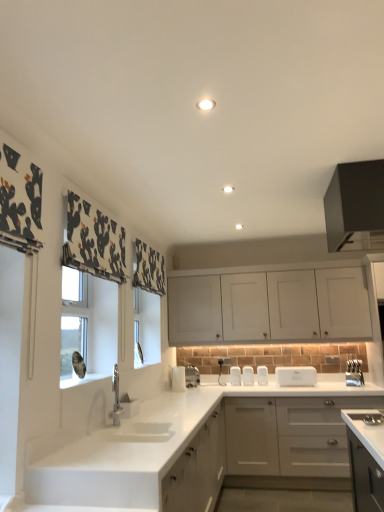
The height and width of the screenshot is (512, 384). In order to click on white plastic toaster at center, acting as the 5th appliance starting from the right in this screenshot , I will do `click(235, 376)`.

The image size is (384, 512). What do you see at coordinates (296, 376) in the screenshot?
I see `white plastic toaster at center, which appears as the 2th appliance when viewed from the right` at bounding box center [296, 376].

How much space does white glossy toaster at lower center, the seventh appliance positioned from the right, occupy horizontally?

The width of white glossy toaster at lower center, the seventh appliance positioned from the right, is 8.81 inches.

The height and width of the screenshot is (512, 384). What are the coordinates of `silver metallic knife block at right, which is counted as the first appliance, starting from the right` in the screenshot? It's located at (354, 373).

This screenshot has height=512, width=384. Describe the element at coordinates (262, 375) in the screenshot. I see `white plastic toaster at center, which is the 3th appliance from right to left` at that location.

How much space does white matte cabinet at upper center, which is counted as the 2th cabinetry, starting from the bottom, occupy horizontally?

It is 16.98 inches.

What are the coordinates of `black matte cabinet at upper right, positioned as the 1th cabinetry in top-to-bottom order` in the screenshot? It's located at (355, 207).

Which object is wider, black matte cabinet at upper right, positioned as the 1th cabinetry in top-to-bottom order, or white plastic toaster at center, which appears as the 2th appliance when viewed from the right?

With larger width is black matte cabinet at upper right, positioned as the 1th cabinetry in top-to-bottom order.

From a real-world perspective, which object stands above the other?

black matte cabinet at upper right, positioned as the 1th cabinetry in top-to-bottom order.

Is black matte cabinet at upper right, the third cabinetry when ordered from bottom to top, bigger or smaller than white plastic toaster at center, which appears as the 2th appliance when viewed from the right?

In the image, black matte cabinet at upper right, the third cabinetry when ordered from bottom to top, appears to be larger than white plastic toaster at center, which appears as the 2th appliance when viewed from the right.

Could you tell me if black matte cabinet at upper right, the third cabinetry when ordered from bottom to top, is turned towards white plastic toaster at center, which appears as the 2th appliance when viewed from the right?

No, black matte cabinet at upper right, the third cabinetry when ordered from bottom to top, does not turn towards white plastic toaster at center, which appears as the 2th appliance when viewed from the right.

Could you measure the distance between white matte cabinet at upper center, marked as the second cabinetry in a top-to-bottom arrangement, and satin nickel faucet at center, the sixth appliance in the right-to-left sequence?

3.42 feet.

From a real-world perspective, starting from the white matte cabinet at upper center, marked as the second cabinetry in a top-to-bottom arrangement, which appliance is the 3rd one below it? Please provide its 2D coordinates.

[(192, 376)]

How many degrees apart are the facing directions of white matte cabinet at upper center, marked as the second cabinetry in a top-to-bottom arrangement, and satin nickel faucet at center, the second appliance viewed from the left?

45 degrees separate the facing orientations of white matte cabinet at upper center, marked as the second cabinetry in a top-to-bottom arrangement, and satin nickel faucet at center, the second appliance viewed from the left.

From the image's perspective, which is above, white matte cabinet at upper center, which is counted as the 2th cabinetry, starting from the bottom, or satin nickel faucet at center, the second appliance viewed from the left?

white matte cabinet at upper center, which is counted as the 2th cabinetry, starting from the bottom, appears higher in the image.

Which object is closer to the camera, white plastic toaster at center, placed as the 5th appliance when sorted from left to right, or satin nickel faucet at center, the sixth appliance in the right-to-left sequence?

satin nickel faucet at center, the sixth appliance in the right-to-left sequence.

Considering the relative sizes of white plastic toaster at center, placed as the 5th appliance when sorted from left to right, and satin nickel faucet at center, the second appliance viewed from the left, in the image provided, is white plastic toaster at center, placed as the 5th appliance when sorted from left to right, bigger than satin nickel faucet at center, the second appliance viewed from the left,?

Actually, white plastic toaster at center, placed as the 5th appliance when sorted from left to right, might be smaller than satin nickel faucet at center, the second appliance viewed from the left.

Is white plastic toaster at center, which is the 3th appliance from right to left, positioned far away from satin nickel faucet at center, the second appliance viewed from the left?

white plastic toaster at center, which is the 3th appliance from right to left, is near satin nickel faucet at center, the second appliance viewed from the left, not far away.

Would you say black matte cabinet at upper right, the third cabinetry when ordered from bottom to top, is part of white plastic toaster at center, the fourth appliance when ordered from right to left,'s contents?

That's incorrect, black matte cabinet at upper right, the third cabinetry when ordered from bottom to top, is not inside white plastic toaster at center, the fourth appliance when ordered from right to left.

From a real-world perspective, which is physically below, white plastic toaster at center, positioned as the fourth appliance in left-to-right order, or black matte cabinet at upper right, the third cabinetry when ordered from bottom to top?

white plastic toaster at center, positioned as the fourth appliance in left-to-right order, from a real-world perspective.

Considering the sizes of white plastic toaster at center, positioned as the fourth appliance in left-to-right order, and black matte cabinet at upper right, the third cabinetry when ordered from bottom to top, in the image, is white plastic toaster at center, positioned as the fourth appliance in left-to-right order, wider or thinner than black matte cabinet at upper right, the third cabinetry when ordered from bottom to top,?

In the image, white plastic toaster at center, positioned as the fourth appliance in left-to-right order, appears to be more narrow than black matte cabinet at upper right, the third cabinetry when ordered from bottom to top.

How far apart are white plastic toaster at center, the fourth appliance when ordered from right to left, and black matte cabinet at upper right, the third cabinetry when ordered from bottom to top?

They are 7.36 feet apart.

Is the position of satin nickel faucet at center, the second appliance viewed from the left, more distant than that of white glossy toaster at lower center, the 1th appliance in the left-to-right sequence?

That is True.

Is white glossy toaster at lower center, the seventh appliance positioned from the right, inside satin nickel faucet at center, the sixth appliance in the right-to-left sequence?

No, white glossy toaster at lower center, the seventh appliance positioned from the right, is not inside satin nickel faucet at center, the sixth appliance in the right-to-left sequence.

Which is more to the right, satin nickel faucet at center, the sixth appliance in the right-to-left sequence, or white glossy toaster at lower center, the 1th appliance in the left-to-right sequence?

Positioned to the right is satin nickel faucet at center, the sixth appliance in the right-to-left sequence.

From their relative heights in the image, would you say satin nickel faucet at center, the second appliance viewed from the left, is taller or shorter than white glossy toaster at lower center, the 1th appliance in the left-to-right sequence?

Clearly, satin nickel faucet at center, the second appliance viewed from the left, is shorter compared to white glossy toaster at lower center, the 1th appliance in the left-to-right sequence.

Which of these two, white matte cabinet at lower left, the 3th cabinetry when ordered from top to bottom, or white plastic toaster at center, the fourth appliance when ordered from right to left, is wider?

white matte cabinet at lower left, the 3th cabinetry when ordered from top to bottom, is wider.

Is white matte cabinet at lower left, the 1th cabinetry positioned from the bottom, closer to the viewer compared to white plastic toaster at center, the fourth appliance when ordered from right to left?

Yes, white matte cabinet at lower left, the 1th cabinetry positioned from the bottom, is in front of white plastic toaster at center, the fourth appliance when ordered from right to left.

Is white matte cabinet at lower left, the 3th cabinetry when ordered from top to bottom, inside the boundaries of white plastic toaster at center, the fourth appliance when ordered from right to left, or outside?

white matte cabinet at lower left, the 3th cabinetry when ordered from top to bottom, is not enclosed by white plastic toaster at center, the fourth appliance when ordered from right to left.

Is point (286, 372) closer or farther from the camera than point (257, 281)?

Point (286, 372) is closer to the camera than point (257, 281).

There is a white matte cabinet at upper center, marked as the second cabinetry in a top-to-bottom arrangement. Identify the location of the 3rd appliance below it (from the image's perspective). (296, 376).

From the image's perspective, is white plastic toaster at center, marked as the sixth appliance in a left-to-right arrangement, located above or below white matte cabinet at upper center, which is counted as the 2th cabinetry, starting from the bottom?

white plastic toaster at center, marked as the sixth appliance in a left-to-right arrangement, is below white matte cabinet at upper center, which is counted as the 2th cabinetry, starting from the bottom.

Consider the image. Would you say white matte cabinet at upper center, which is counted as the 2th cabinetry, starting from the bottom, is part of white plastic toaster at center, which appears as the 2th appliance when viewed from the right,'s contents?

No, white matte cabinet at upper center, which is counted as the 2th cabinetry, starting from the bottom, is not inside white plastic toaster at center, which appears as the 2th appliance when viewed from the right.

Find the location of a particular element. appliance that is the 3rd one when counting backward from the black matte cabinet at upper right, the third cabinetry when ordered from bottom to top is located at coordinates (296, 376).

The height and width of the screenshot is (512, 384). I want to click on cabinetry that is the 1st one when counting upward from the satin nickel faucet at center, the second appliance viewed from the left (from the image's perspective), so click(269, 306).

Considering their positions, is silver metallic knife block at right, which is counted as the first appliance, starting from the right, positioned further to white plastic toaster at center, which appears as the 2th appliance when viewed from the right, than white plastic toaster at center, placed as the 5th appliance when sorted from left to right?

silver metallic knife block at right, which is counted as the first appliance, starting from the right, is further to white plastic toaster at center, which appears as the 2th appliance when viewed from the right.

Estimate the real-world distances between objects in this image. Which object is further from white plastic toaster at center, which appears as the 2th appliance when viewed from the right, white plastic toaster at center, the fourth appliance when ordered from right to left, or white plastic toaster at center, acting as the 5th appliance starting from the right?

white plastic toaster at center, acting as the 5th appliance starting from the right.

Estimate the real-world distances between objects in this image. Which object is further from white matte cabinet at lower left, the 1th cabinetry positioned from the bottom, white matte cabinet at upper center, marked as the second cabinetry in a top-to-bottom arrangement, or white plastic toaster at center, which appears as the 2th appliance when viewed from the right?

Among the two, white matte cabinet at upper center, marked as the second cabinetry in a top-to-bottom arrangement, is located further to white matte cabinet at lower left, the 1th cabinetry positioned from the bottom.

From the image, which object appears to be farther from satin nickel faucet at center, the second appliance viewed from the left, white matte cabinet at lower left, the 3th cabinetry when ordered from top to bottom, or white plastic toaster at center, acting as the 5th appliance starting from the right?

white matte cabinet at lower left, the 3th cabinetry when ordered from top to bottom.

When comparing their distances from white plastic toaster at center, which is the 3th appliance from right to left, does white plastic toaster at center, marked as the sixth appliance in a left-to-right arrangement, or black matte cabinet at upper right, the third cabinetry when ordered from bottom to top, seem further?

black matte cabinet at upper right, the third cabinetry when ordered from bottom to top, lies further to white plastic toaster at center, which is the 3th appliance from right to left, than the other object.

Looking at the image, which one is located further to white matte cabinet at lower left, the 3th cabinetry when ordered from top to bottom, white plastic toaster at center, positioned as the fourth appliance in left-to-right order, or satin nickel faucet at center, the sixth appliance in the right-to-left sequence?

satin nickel faucet at center, the sixth appliance in the right-to-left sequence, lies further to white matte cabinet at lower left, the 3th cabinetry when ordered from top to bottom, than the other object.

When comparing their distances from black matte cabinet at upper right, the third cabinetry when ordered from bottom to top, does white glossy toaster at lower center, the 1th appliance in the left-to-right sequence, or white plastic toaster at center, placed as the 5th appliance when sorted from left to right, seem closer?

The object closer to black matte cabinet at upper right, the third cabinetry when ordered from bottom to top, is white plastic toaster at center, placed as the 5th appliance when sorted from left to right.

Estimate the real-world distances between objects in this image. Which object is closer to white matte cabinet at upper center, marked as the second cabinetry in a top-to-bottom arrangement, white plastic toaster at center, which is counted as the 3th appliance, starting from the left, or white glossy toaster at lower center, the seventh appliance positioned from the right?

Based on the image, white plastic toaster at center, which is counted as the 3th appliance, starting from the left, appears to be nearer to white matte cabinet at upper center, marked as the second cabinetry in a top-to-bottom arrangement.

Where is `cabinetry positioned between black matte cabinet at upper right, the third cabinetry when ordered from bottom to top, and white plastic toaster at center, marked as the sixth appliance in a left-to-right arrangement, from near to far`? The height and width of the screenshot is (512, 384). cabinetry positioned between black matte cabinet at upper right, the third cabinetry when ordered from bottom to top, and white plastic toaster at center, marked as the sixth appliance in a left-to-right arrangement, from near to far is located at coordinates (269, 306).

Image resolution: width=384 pixels, height=512 pixels. I want to click on appliance between black matte cabinet at upper right, positioned as the 1th cabinetry in top-to-bottom order, and silver metallic knife block at right, which is counted as the first appliance, starting from the right, in the front-back direction, so click(185, 377).

Locate an element on the screen. The height and width of the screenshot is (512, 384). cabinetry positioned between black matte cabinet at upper right, the third cabinetry when ordered from bottom to top, and white plastic toaster at center, acting as the 5th appliance starting from the right, from near to far is located at coordinates (269, 306).

Locate an element on the screen. The image size is (384, 512). cabinetry located between black matte cabinet at upper right, the third cabinetry when ordered from bottom to top, and white glossy toaster at lower center, the 1th appliance in the left-to-right sequence, in the depth direction is located at coordinates (269, 306).